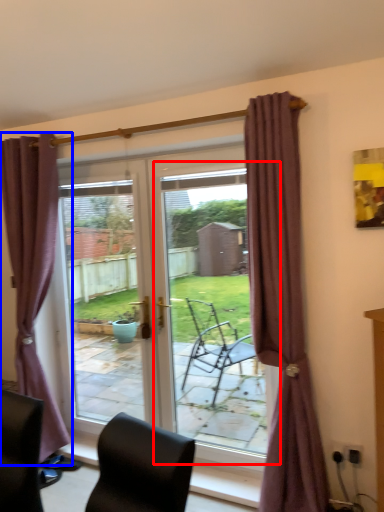
Question: Which point is closer to the camera, screen door (highlighted by a red box) or curtain (highlighted by a blue box)?

Choices:
 (A) screen door
 (B) curtain

Answer: (A)